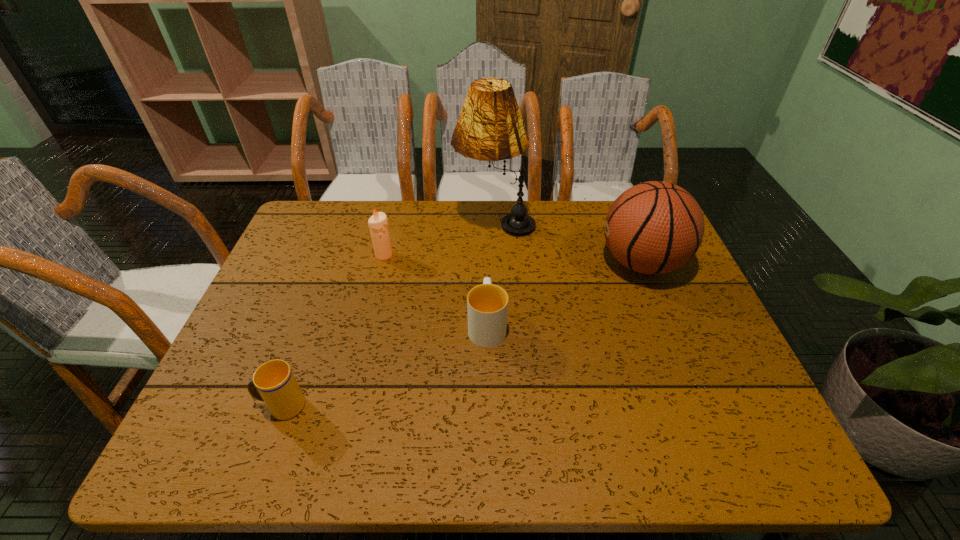
In order to click on free point that satisfies the following two spatial constraints: 1. on the side of the leftmost object with the handle; 2. on the back side of the fourth object from right to left in this screenshot , I will do `click(337, 255)`.

Locate an element on the screen. free spot that satisfies the following two spatial constraints: 1. on the side of the nearest object with the handle; 2. with the handle on the side of the second nearest object is located at coordinates (311, 325).